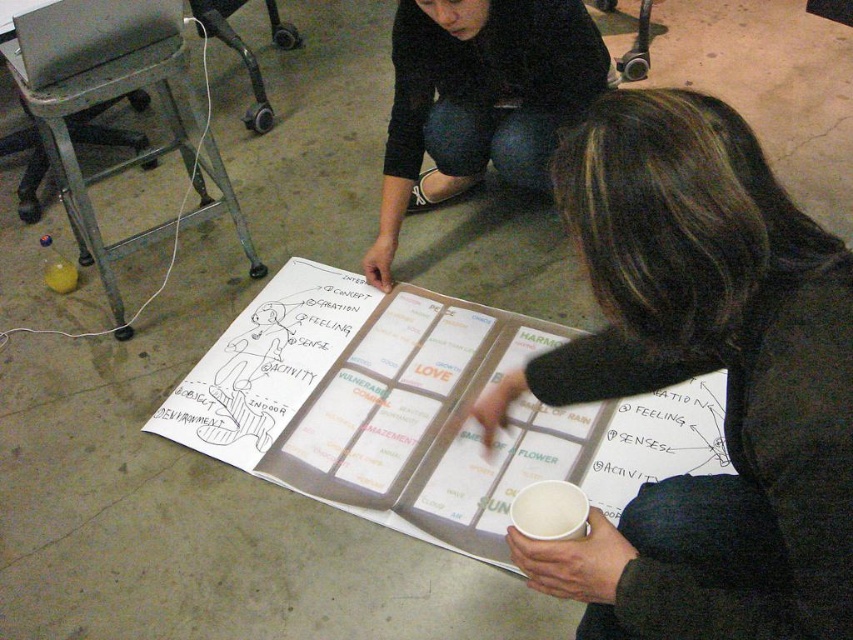
Based on the scene description, where exactly is the black fabric at center located in terms of coordinates?

The black fabric at center is located at the 2D coordinates point of (479, 100).

You are a delivery robot that needs to place a small package on the white paper cup at lower center without disturbing the black fabric at center. Can you safely place the package there if the robot arm has a reach of 3 feet?

The distance between the black fabric at center and the white paper cup at lower center is 3.29 feet. Since the robot arm can only reach 3 feet, it cannot safely place the package on the white paper cup at lower center without moving closer or extending its reach.

You are standing in front of the collaborative paper and want to touch both the point at (728,262) and the point at (416,97). Which point should you reach for first to touch the one closer to you?

You should reach for point at (728,262) first because it is closer to you than point at (416,97).